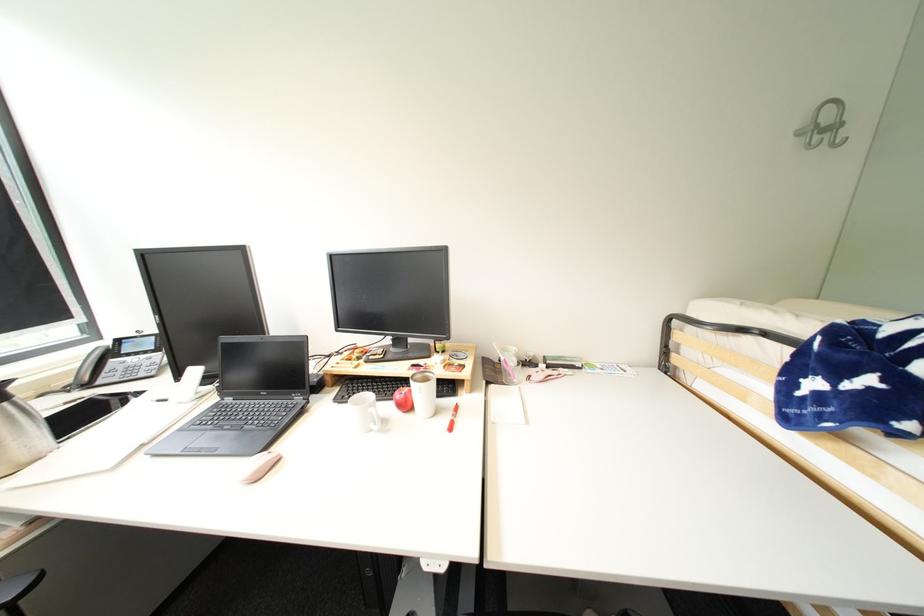
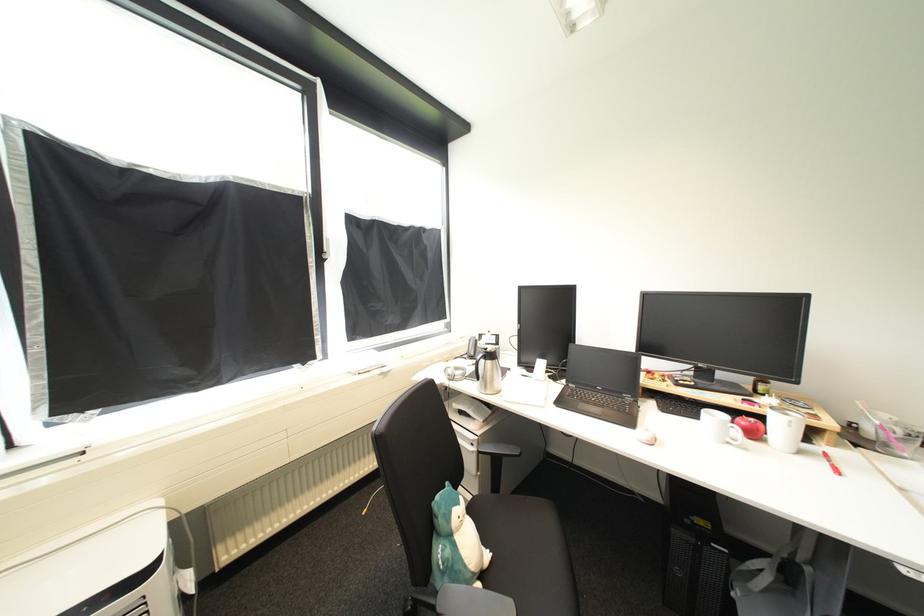
In the second image, find the point that corresponds to the point at 412,408 in the first image.

(761, 436)